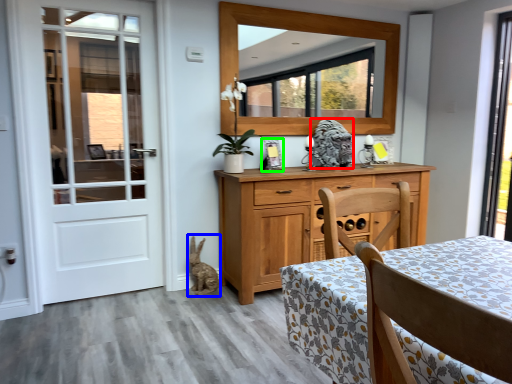
Question: Based on their relative distances, which object is nearer to animal (highlighted by a red box)? Choose from animal (highlighted by a blue box) and picture frame (highlighted by a green box).

Choices:
 (A) animal
 (B) picture frame

Answer: (B)